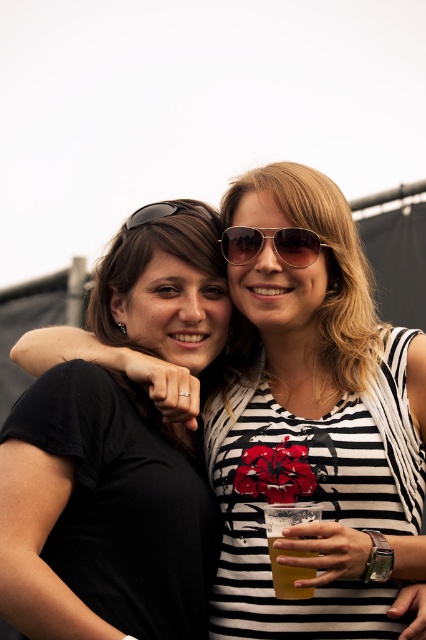
Does black matte shirt at center appear under translucent plastic cup at lower center?

No.

Does black matte shirt at center have a smaller size compared to translucent plastic cup at lower center?

Incorrect, black matte shirt at center is not smaller in size than translucent plastic cup at lower center.

I want to click on black matte shirt at center, so click(316, 426).

Where is `black matte shirt at center`? Image resolution: width=426 pixels, height=640 pixels. black matte shirt at center is located at coordinates (316, 426).

Which is in front, point (78, 600) or point (281, 589)?

Positioned in front is point (281, 589).

From the picture: Who is positioned more to the right, black matte shirt at left or translucent plastic cup at lower center?

translucent plastic cup at lower center

Measure the distance between point (85, 426) and camera.

A distance of 18.41 feet exists between point (85, 426) and camera.

Locate an element on the screen. black matte shirt at left is located at coordinates (106, 522).

Is point (414, 474) positioned after point (149, 221)?

That is False.

Image resolution: width=426 pixels, height=640 pixels. What do you see at coordinates (316, 426) in the screenshot?
I see `black matte shirt at center` at bounding box center [316, 426].

The width and height of the screenshot is (426, 640). Find the location of `black matte shirt at center`. black matte shirt at center is located at coordinates (316, 426).